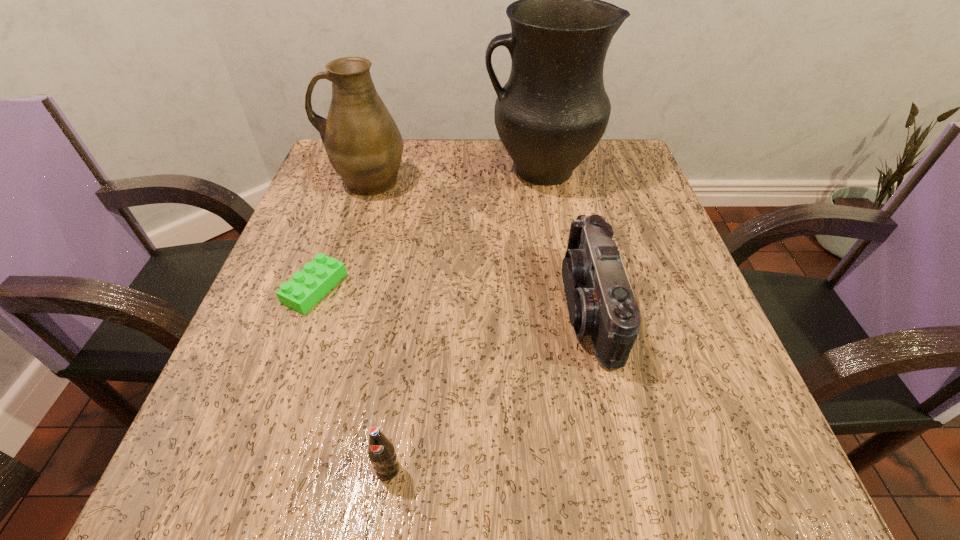
Where is `the right pitcher`? the right pitcher is located at coordinates (552, 112).

In order to click on the taller pitcher in this screenshot , I will do `click(552, 112)`.

Identify the location of the shorter pitcher. This screenshot has height=540, width=960. (363, 143).

Find the location of a particular element. The width and height of the screenshot is (960, 540). the fourth shortest object is located at coordinates (363, 143).

Where is `camcorder`? camcorder is located at coordinates (601, 303).

Where is `the nearest object`? The height and width of the screenshot is (540, 960). the nearest object is located at coordinates (381, 452).

Identify the location of pop. pos(381,452).

Identify the location of Lego. Image resolution: width=960 pixels, height=540 pixels. tap(307, 287).

What are the coordinates of `free space located on the handle side of the taller pitcher` in the screenshot? It's located at (334, 170).

Find the location of a particular element. This screenshot has width=960, height=540. vacant point located 0.290m on the handle side of the taller pitcher is located at coordinates (360, 170).